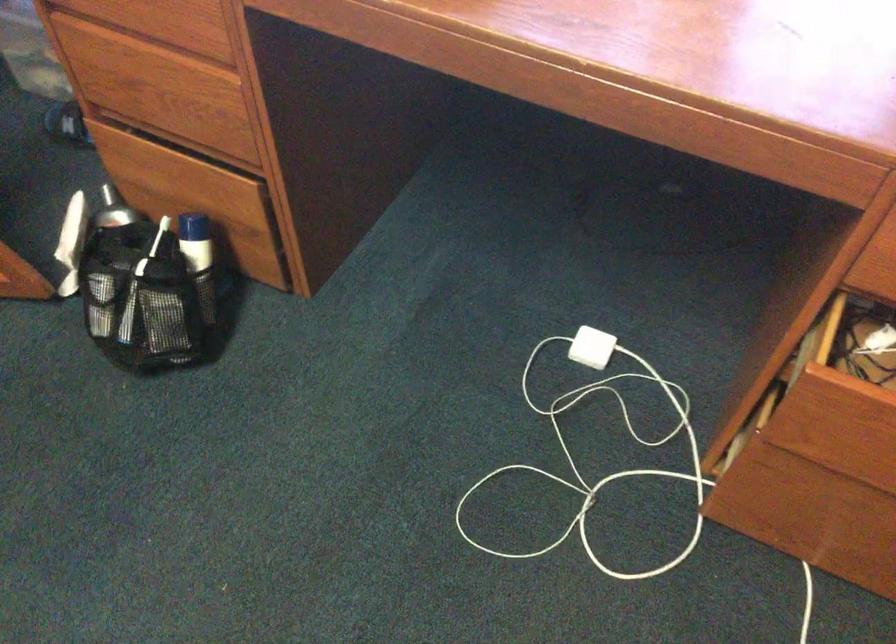
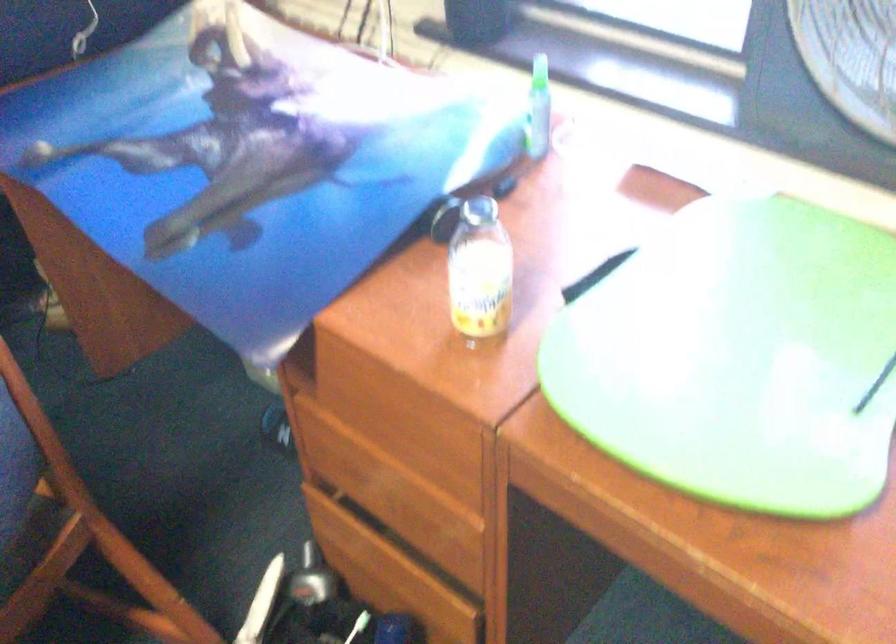
Question: The camera is either moving clockwise (left) or counter-clockwise (right) around the object. The first image is from the beginning of the video and the second image is from the end. Is the camera moving left or right when shooting the video?

Choices:
 (A) Left
 (B) Right

Answer: (B)